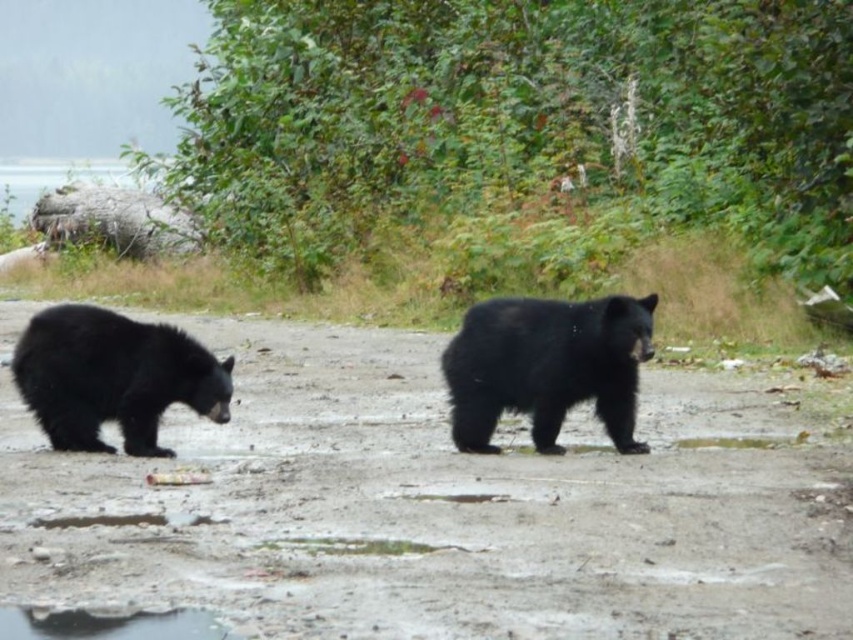
You are a wildlife photographer aiming to capture a closeup shot of the black furry bear at center. Your camera has a maximum focus range of 5 meters. Can you take the photo from your current position?

The black furry bear at center is 7.02 meters away from camera, which exceeds the maximum focus range of 5 meters. Therefore, you cannot take the closeup shot from your current position.

Looking at this image, you are a wildlife photographer trying to capture a photo of both black furry bear at center and black furry bear at left. Your camera has a maximum focus range of 2 meters. Can you take a photo that includes both bears without moving your position?

The black furry bear at center is 2.24 meters away from the black furry bear at left. Since the distance between them exceeds the camera maximum focus range of 2 meters, you cannot take a photo that includes both bears without moving your position.

You are standing in the middle of the image and want to walk to both points. Which point should you reach first, point [650,308] or point [57,308]?

You will reach point [650,308] first because it is closer to you than point [57,308].